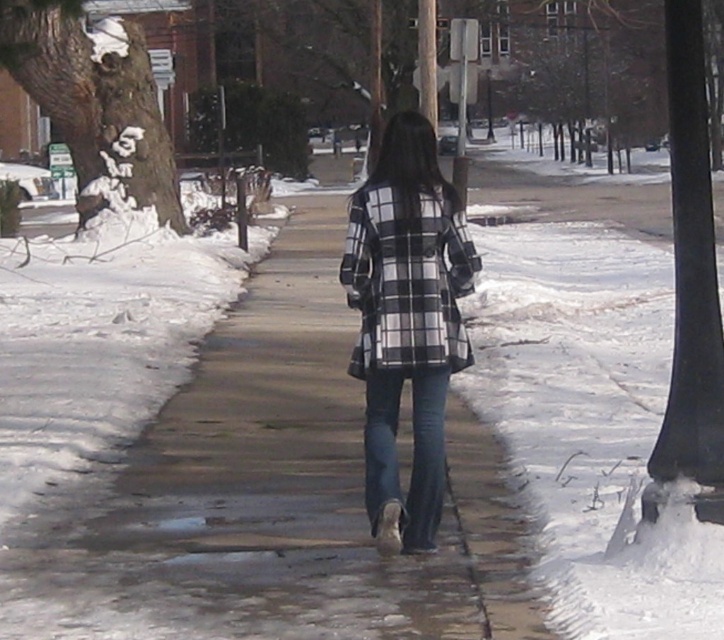
Who is positioned more to the right, black smooth pole at right or black checkered coat at center?

black smooth pole at right is more to the right.

Is black smooth pole at right below black checkered coat at center?

No, black smooth pole at right is not below black checkered coat at center.

At what (x,y) coordinates should I click in order to perform the action: click on black smooth pole at right. Please return your answer as a coordinate pair (x, y). This screenshot has height=640, width=724. Looking at the image, I should click on (690, 284).

The height and width of the screenshot is (640, 724). Identify the location of black smooth pole at right. (690, 284).

Does plaid fabric coat at center have a lesser height compared to black smooth pole at right?

Correct, plaid fabric coat at center is not as tall as black smooth pole at right.

Is plaid fabric coat at center bigger than black smooth pole at right?

No, plaid fabric coat at center is not bigger than black smooth pole at right.

This screenshot has width=724, height=640. I want to click on plaid fabric coat at center, so click(x=405, y=323).

The image size is (724, 640). In order to click on plaid fabric coat at center in this screenshot , I will do `click(405, 323)`.

Which is in front, point (450, 257) or point (421, 481)?

Positioned in front is point (450, 257).

Who is positioned more to the right, plaid fabric coat at center or blue denim jeans at center?

Positioned to the right is plaid fabric coat at center.

Who is more forward, (439, 288) or (434, 490)?

Point (439, 288) is more forward.

You are a GUI agent. You are given a task and a screenshot of the screen. Output one action in this format:
    pyautogui.click(x=<x>, y=<y>)
    Task: Click on the plaid fabric coat at center
    The width and height of the screenshot is (724, 640).
    Given the screenshot: What is the action you would take?
    pyautogui.click(x=405, y=323)